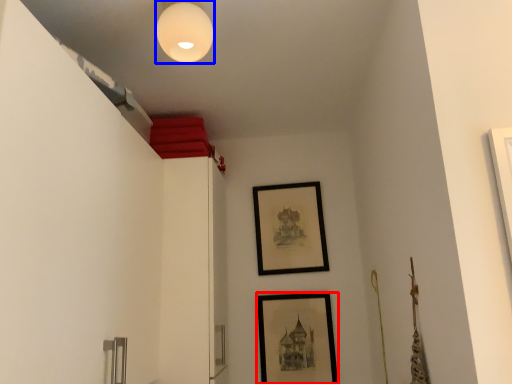
Question: Which object appears farthest to the camera in this image, picture frame (highlighted by a red box) or light fixture (highlighted by a blue box)?

Choices:
 (A) picture frame
 (B) light fixture

Answer: (A)